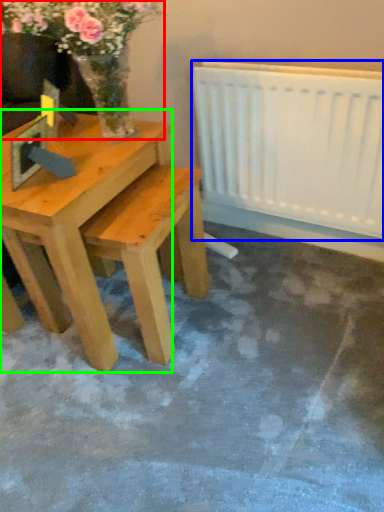
Question: Which object is positioned closest to floral arrangement (highlighted by a red box)? Select from radiator (highlighted by a blue box) and table (highlighted by a green box).

Choices:
 (A) radiator
 (B) table

Answer: (B)